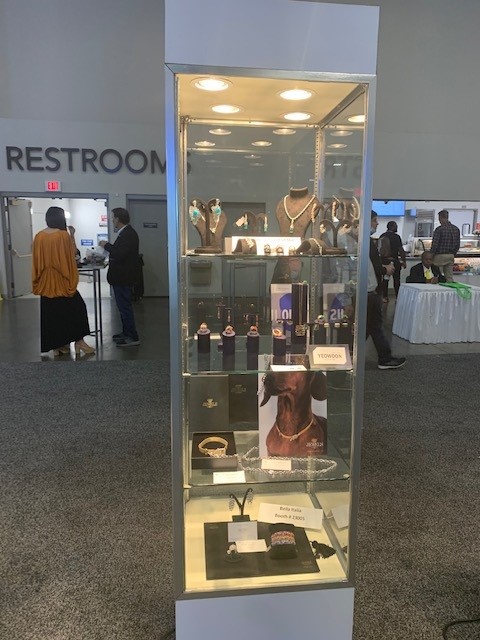
Where is `display case`? display case is located at coordinates (260, 160).